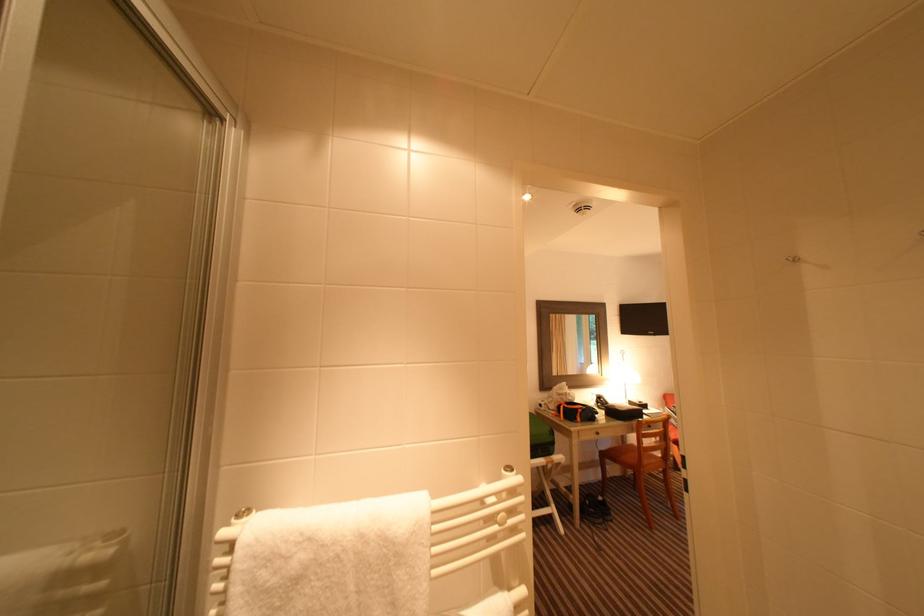
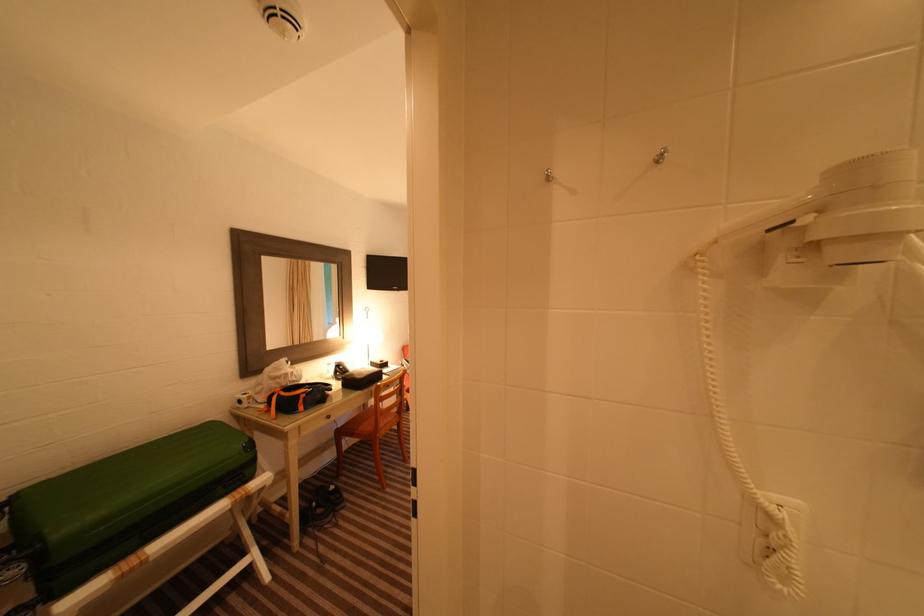
In the second image, find the point that corresponds to point (611, 450) in the first image.

(347, 426)